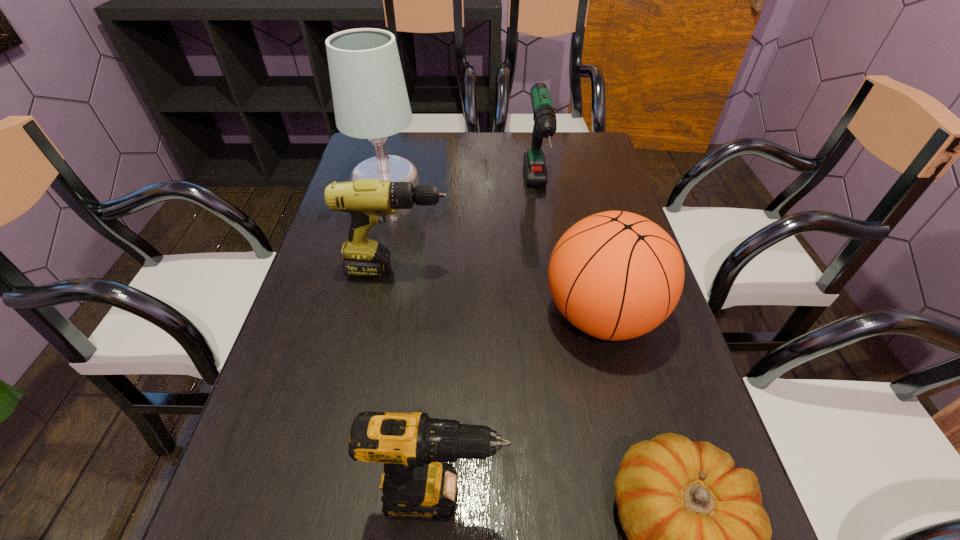
What are the coordinates of `lampshade` in the screenshot? It's located at (370, 99).

The width and height of the screenshot is (960, 540). Identify the location of the farthest drill. (545, 124).

The height and width of the screenshot is (540, 960). Find the location of `the second farthest drill`. the second farthest drill is located at coordinates (368, 201).

Identify the location of basketball. The image size is (960, 540). (615, 275).

What are the coordinates of `the nearest drill` in the screenshot? It's located at (415, 486).

Locate an element on the screen. The height and width of the screenshot is (540, 960). vacant area located on the base of the lampshade is located at coordinates (468, 187).

Locate an element on the screen. The height and width of the screenshot is (540, 960). free spot located 0.080m on the handle side of the rightmost drill is located at coordinates (545, 244).

This screenshot has height=540, width=960. I want to click on free location located 0.230m on the handle side of the second farthest drill, so click(545, 270).

Locate an element on the screen. The image size is (960, 540). vacant area situated 0.200m on the front of the basketball is located at coordinates (639, 468).

Where is `free space located 0.170m at the tip of the nearest drill`? This screenshot has height=540, width=960. free space located 0.170m at the tip of the nearest drill is located at coordinates (611, 496).